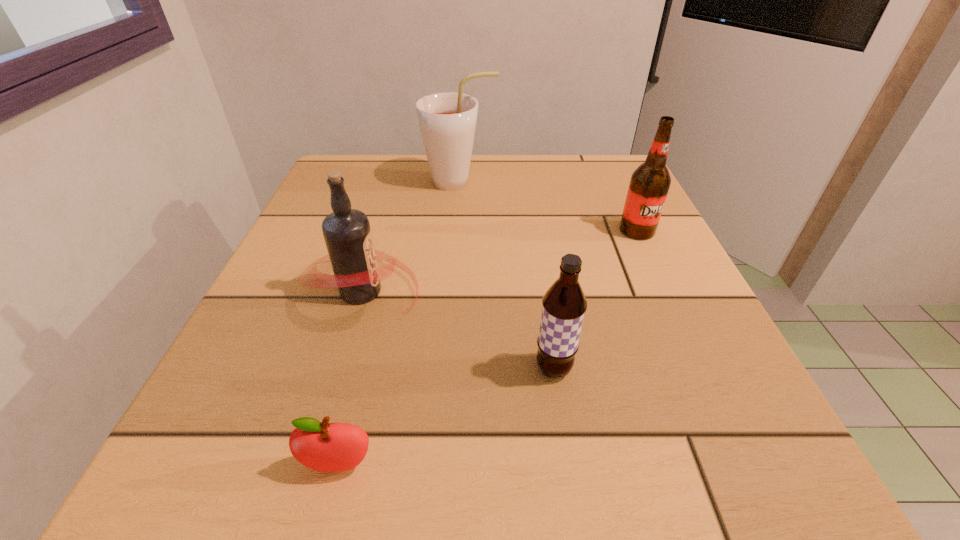
You are a GUI agent. You are given a task and a screenshot of the screen. Output one action in this format:
    pyautogui.click(x=<x>, y=<y>)
    Task: Click on the farthest object
    The width and height of the screenshot is (960, 540).
    Given the screenshot: What is the action you would take?
    pyautogui.click(x=447, y=120)

Locate an element on the screen. the third nearest root beer is located at coordinates (649, 185).

Where is `the rightmost root beer`? The image size is (960, 540). the rightmost root beer is located at coordinates (649, 185).

The image size is (960, 540). What are the coordinates of `the third farthest root beer` in the screenshot? It's located at (347, 233).

Identify the location of the nearest root beer. (564, 305).

At what (x,y) coordinates should I click in order to perform the action: click on the third root beer from left to right. Please return your answer as a coordinate pair (x, y). Looking at the image, I should click on (564, 305).

I want to click on apple, so click(329, 447).

Locate an element on the screen. the shortest object is located at coordinates (329, 447).

At what (x,y) coordinates should I click in order to perform the action: click on free spot located on the drink side of the farthest object. Please return your answer as a coordinate pair (x, y). The image size is (960, 540). Looking at the image, I should click on (580, 182).

I want to click on free space located 0.210m on the back of the second farthest object, so click(x=610, y=171).